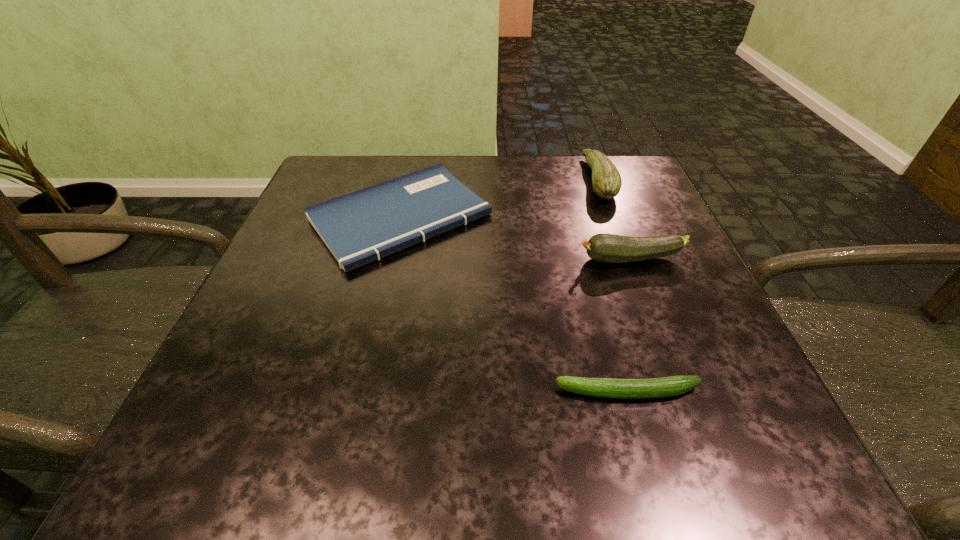
I want to click on vacant space in between the shortest zucchini and the second nearest zucchini, so click(629, 326).

This screenshot has height=540, width=960. I want to click on free space between the second farthest zucchini and the farthest zucchini, so click(614, 219).

I want to click on free space that is in between the shortest zucchini and the second farthest zucchini, so click(629, 326).

Locate an element on the screen. The width and height of the screenshot is (960, 540). free space between the leftmost object and the second farthest zucchini is located at coordinates tap(516, 238).

Identify the location of free space between the nearest object and the leftmost object. (514, 305).

Find the location of a particular element. The image size is (960, 540). vacant point located between the second farthest zucchini and the leftmost object is located at coordinates (516, 238).

You are a GUI agent. You are given a task and a screenshot of the screen. Output one action in this format:
    pyautogui.click(x=<x>, y=<y>)
    Task: Click on the empty space between the paperback book and the nearest zucchini
    The image size is (960, 540).
    Given the screenshot: What is the action you would take?
    pyautogui.click(x=514, y=305)

At what (x,y) coordinates should I click in order to perform the action: click on free space that is in between the second farthest zucchini and the paperback book. Please return your answer as a coordinate pair (x, y). Looking at the image, I should click on (516, 238).

Choose which object is the second nearest neighbor to the second farthest zucchini. Please provide its 2D coordinates. Your answer should be formatted as a tuple, i.e. [(x, y)], where the tuple contains the x and y coordinates of a point satisfying the conditions above.

[(363, 226)]

Find the location of a particular element. The height and width of the screenshot is (540, 960). the second closest object to the second nearest zucchini is located at coordinates (363, 226).